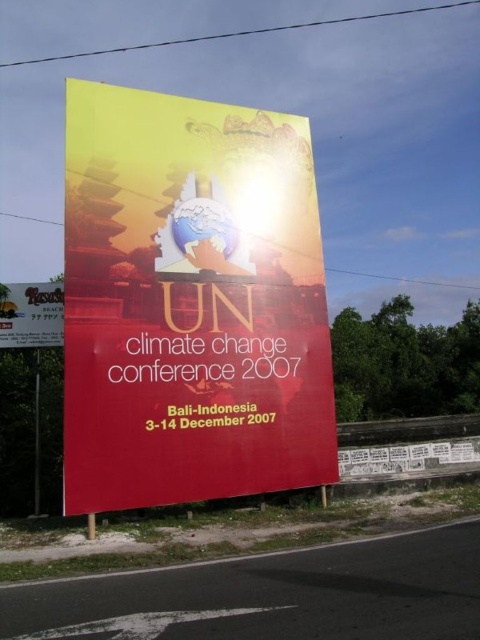
You are standing in front of a large billboard for the UN Climate Change Conference 2007. There is a point marked at coordinates (191,301). Based on the scene description, what object is located at that point?

The point at coordinates (191,301) indicates the location of the matte yellow poster at center.

You are a passerby standing on the roadside looking at the billboard. Which object, the matte yellow poster at center or the yellow matte signboard at upper center, is larger in size?

The yellow matte signboard at upper center is larger than the matte yellow poster at center.

You are a pedestrian standing on the sidewalk looking at the billboard. Which object, the matte yellow poster at center or the yellow matte signboard at upper center, appears larger to you?

The matte yellow poster at center appears larger because it is closer to the viewer than the yellow matte signboard at upper center.